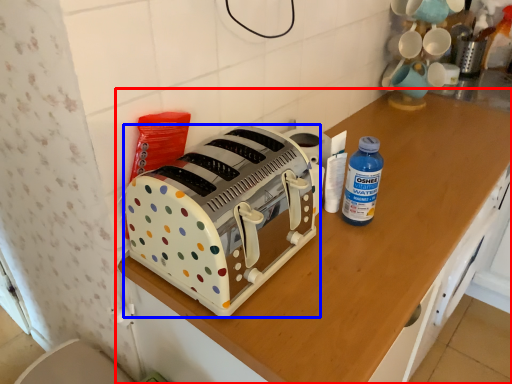
Question: Which object appears closest to the camera in this image, cabinetry (highlighted by a red box) or toaster (highlighted by a blue box)?

Choices:
 (A) cabinetry
 (B) toaster

Answer: (A)